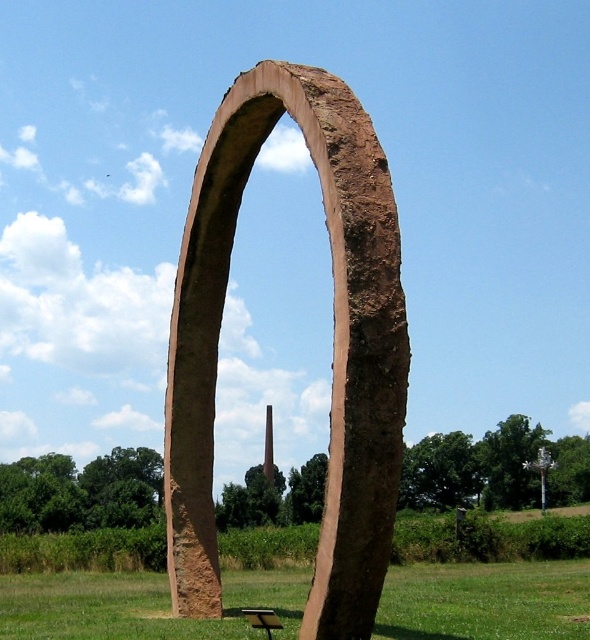
Does brown stone arch at center have a greater height compared to brown wooden picnic table at lower center?

Yes.

Is point (181, 522) more distant than point (254, 620)?

Yes, point (181, 522) is behind point (254, 620).

Is point (168, 417) positioned before point (273, 618)?

No, (168, 417) is behind (273, 618).

Find the location of a particular element. This screenshot has height=640, width=590. brown stone arch at center is located at coordinates (332, 346).

Does brown stone arch at center appear over green grass at center?

Yes, brown stone arch at center is above green grass at center.

Which is behind, point (362, 227) or point (404, 632)?

The point (404, 632) is behind.

The height and width of the screenshot is (640, 590). In order to click on brown stone arch at center in this screenshot , I will do `click(332, 346)`.

Can you confirm if green grass at center is smaller than brown wooden picnic table at lower center?

No.

Is point (579, 620) behind point (264, 614)?

That is True.

Identify the location of green grass at center. (140, 605).